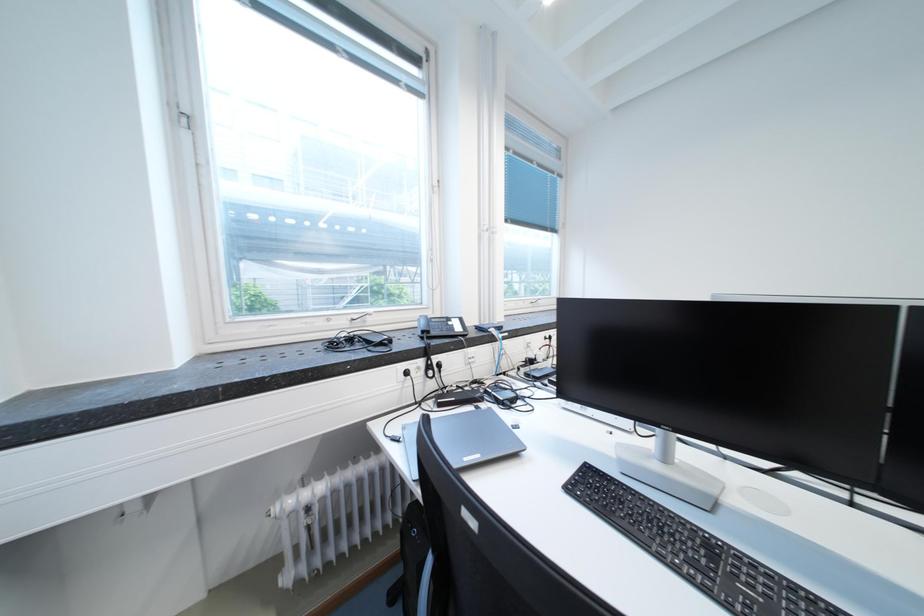
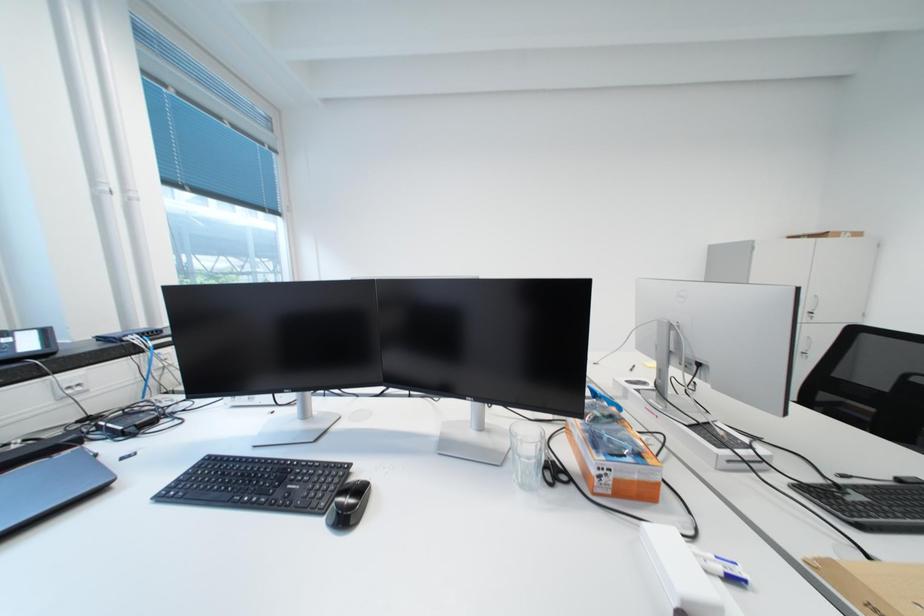
Question: The camera is either moving clockwise (left) or counter-clockwise (right) around the object. The first image is from the beginning of the video and the second image is from the end. Is the camera moving left or right when shooting the video?

Choices:
 (A) Left
 (B) Right

Answer: (A)